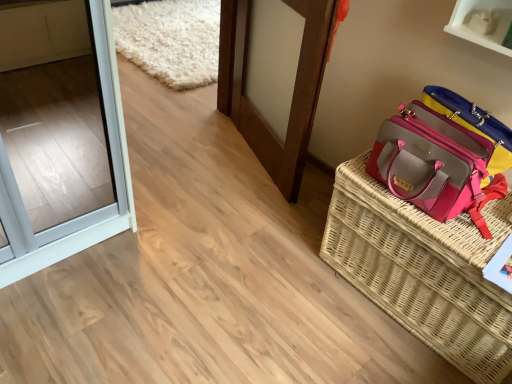
Question: Does pink fabric handbag at right have a lesser height compared to pink woven picnic basket at right?

Choices:
 (A) yes
 (B) no

Answer: (A)

Question: Is pink fabric handbag at right outside pink woven picnic basket at right?

Choices:
 (A) yes
 (B) no

Answer: (A)

Question: Would you say pink woven picnic basket at right is part of pink fabric handbag at right's contents?

Choices:
 (A) yes
 (B) no

Answer: (B)

Question: Considering the relative sizes of pink fabric handbag at right and pink woven picnic basket at right in the image provided, is pink fabric handbag at right thinner than pink woven picnic basket at right?

Choices:
 (A) yes
 (B) no

Answer: (A)

Question: Is the position of pink fabric handbag at right more distant than that of pink woven picnic basket at right?

Choices:
 (A) no
 (B) yes

Answer: (B)

Question: Considering the positions of point (241, 104) and point (338, 246), is point (241, 104) closer or farther from the camera than point (338, 246)?

Choices:
 (A) farther
 (B) closer

Answer: (A)

Question: From the image's perspective, is brown wooden door at center above or below pink woven picnic basket at right?

Choices:
 (A) above
 (B) below

Answer: (A)

Question: In terms of width, does brown wooden door at center look wider or thinner when compared to pink woven picnic basket at right?

Choices:
 (A) wide
 (B) thin

Answer: (B)

Question: Relative to pink woven picnic basket at right, is brown wooden door at center in front or behind?

Choices:
 (A) front
 (B) behind

Answer: (B)

Question: Considering the positions of brown wooden door at center and pink fabric handbag at right in the image, is brown wooden door at center wider or thinner than pink fabric handbag at right?

Choices:
 (A) wide
 (B) thin

Answer: (B)

Question: From the image's perspective, is brown wooden door at center above or below pink fabric handbag at right?

Choices:
 (A) below
 (B) above

Answer: (B)

Question: Based on their sizes in the image, would you say brown wooden door at center is bigger or smaller than pink fabric handbag at right?

Choices:
 (A) small
 (B) big

Answer: (B)

Question: Would you say brown wooden door at center is inside or outside pink fabric handbag at right?

Choices:
 (A) inside
 (B) outside

Answer: (B)

Question: Considering the positions of pink woven picnic basket at right and pink fabric handbag at right in the image, is pink woven picnic basket at right taller or shorter than pink fabric handbag at right?

Choices:
 (A) tall
 (B) short

Answer: (A)

Question: Visually, is pink woven picnic basket at right positioned to the left or to the right of pink fabric handbag at right?

Choices:
 (A) left
 (B) right

Answer: (B)